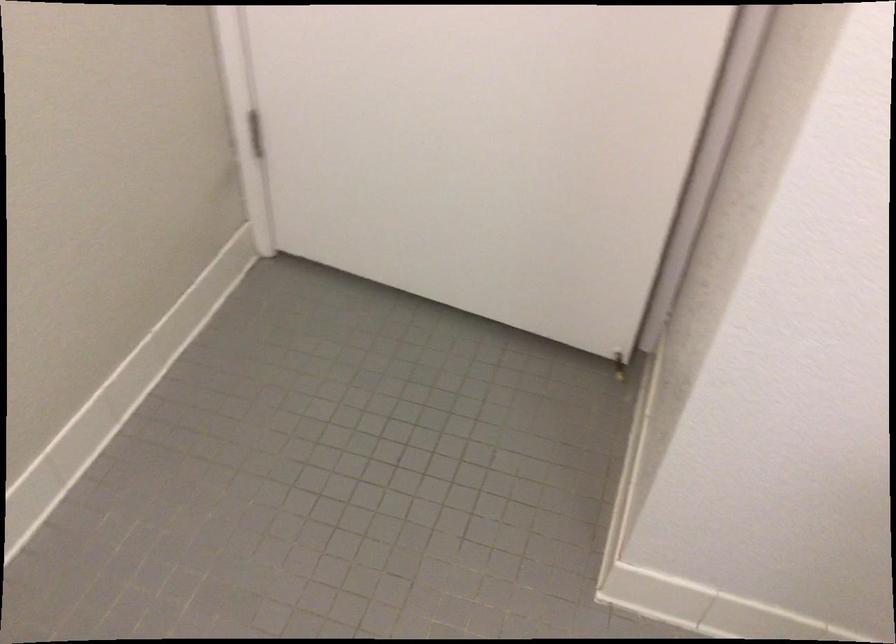
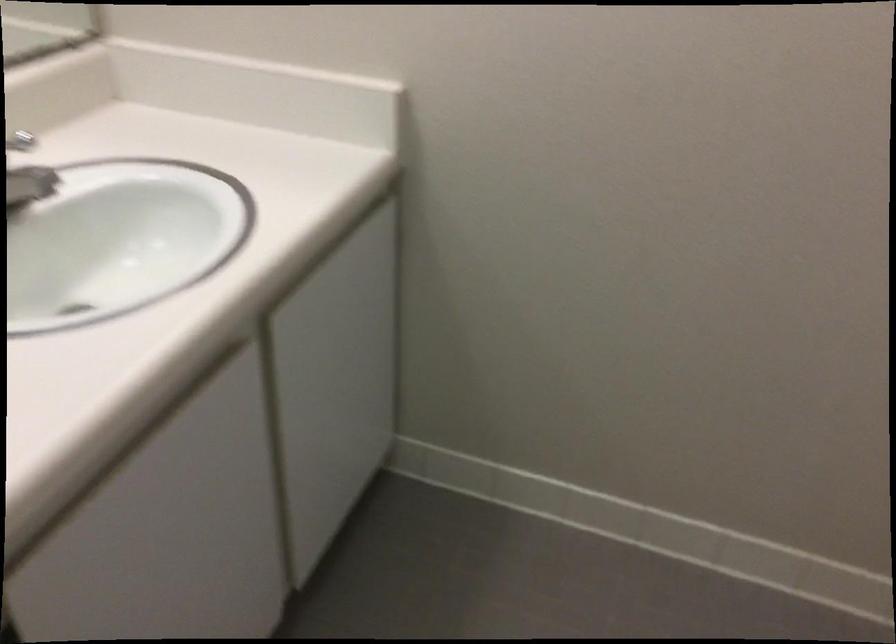
The first image is from the beginning of the video and the second image is from the end. How did the camera likely rotate when shooting the video?

The camera's rotation is toward left-down.